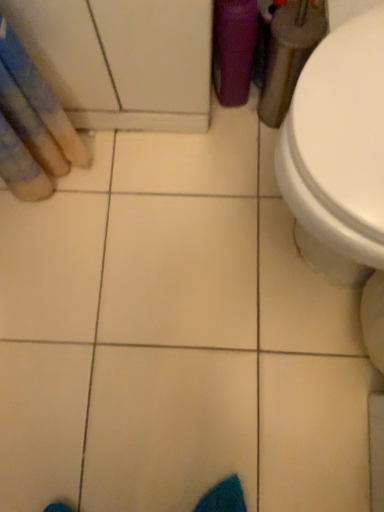
The image size is (384, 512). Find the location of `white glossy toilet at right`. white glossy toilet at right is located at coordinates (338, 152).

The height and width of the screenshot is (512, 384). Describe the element at coordinates (338, 152) in the screenshot. I see `white glossy toilet at right` at that location.

At what (x,y) coordinates should I click in order to perform the action: click on white glossy toilet at right. Please return your answer as a coordinate pair (x, y). This screenshot has height=512, width=384. Looking at the image, I should click on (338, 152).